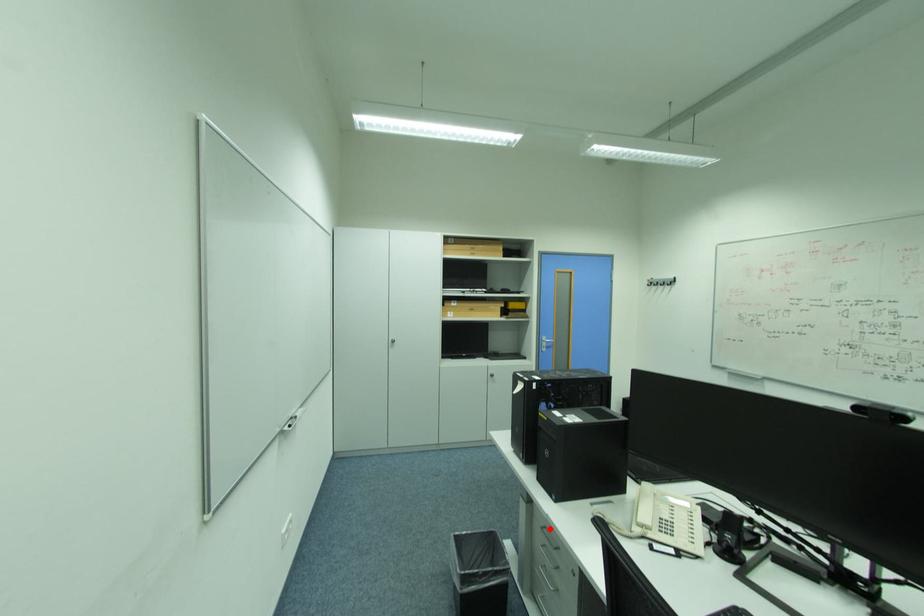
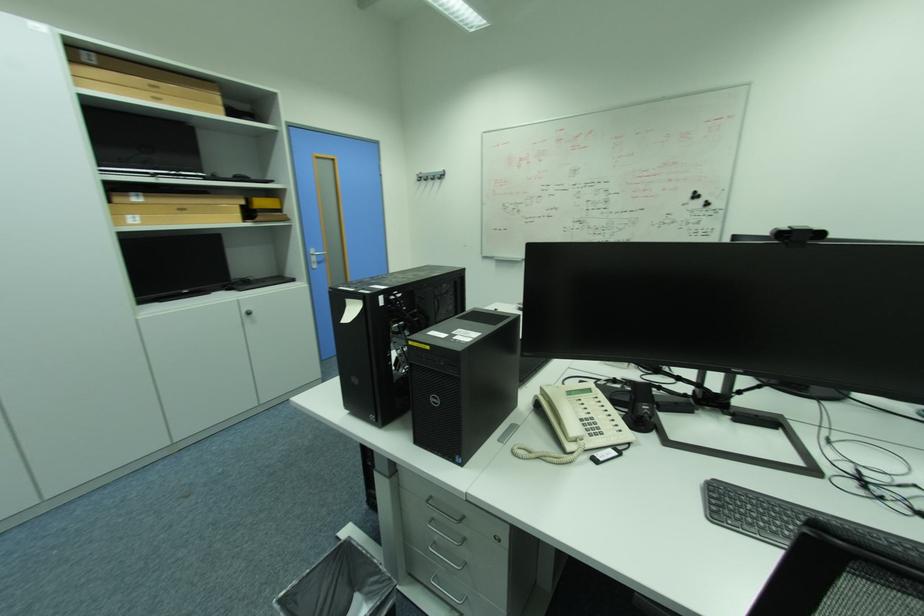
The point at the highlighted location is marked in the first image. Where is the corresponding point in the second image?

(435, 501)